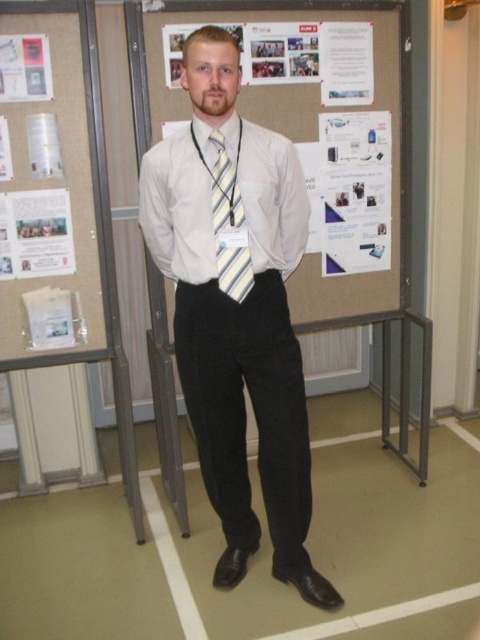
In the scene shown: Who is positioned more to the left, yellow striped tie at center or matte paper poster at upper left?

From the viewer's perspective, matte paper poster at upper left appears more on the left side.

Does point (216, 236) lie behind point (20, 83)?

No, (216, 236) is in front of (20, 83).

This screenshot has height=640, width=480. Find the location of `yellow striped tie at center`. yellow striped tie at center is located at coordinates (228, 220).

Is white smooth dress shirt at center positioned at the back of matte paper poster at upper left?

No, white smooth dress shirt at center is in front of matte paper poster at upper left.

Which is below, white smooth dress shirt at center or matte paper poster at upper left?

white smooth dress shirt at center is lower down.

Is point (262, 141) farther from viewer compared to point (25, 92)?

No, it is not.

I want to click on white smooth dress shirt at center, so click(x=178, y=209).

Does matte paper poster at left appear on the left side of yellow striped tie at center?

Indeed, matte paper poster at left is positioned on the left side of yellow striped tie at center.

Does point (41, 230) come closer to viewer compared to point (233, 209)?

No, (41, 230) is further to viewer.

Is point (61, 208) behind point (224, 145)?

Yes.

This screenshot has width=480, height=640. Identify the location of matte paper poster at left. coord(36,234).